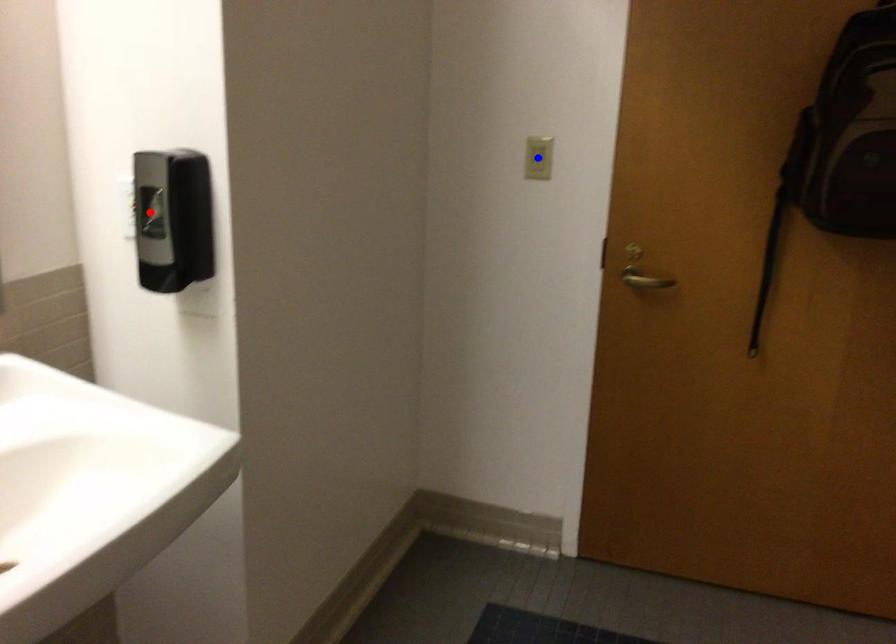
Question: In the image, two points are highlighted. Which point is nearer to the camera? Reply with the corresponding letter.

Choices:
 (A) blue point
 (B) red point

Answer: (B)